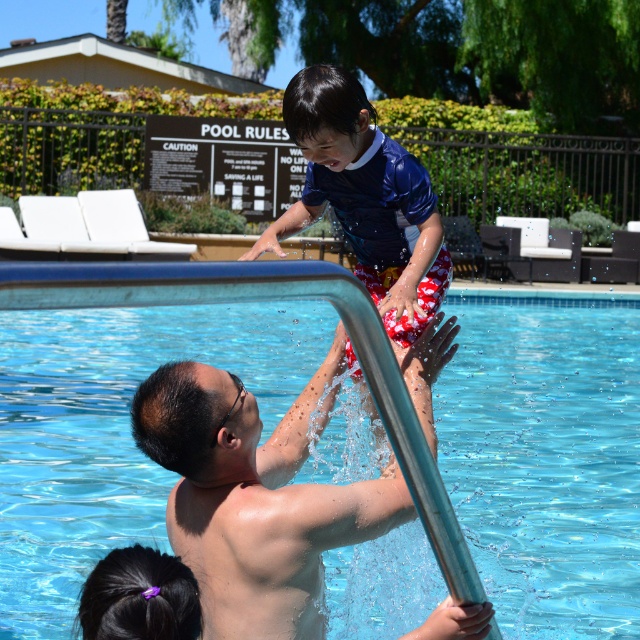
Question: Considering the real-world distances, which object is farthest from the purple hairband at lower left?

Choices:
 (A) shiny silver pole at center
 (B) clear blue water at center

Answer: (B)

Question: Does clear blue water at center appear over purple hairband at lower left?

Choices:
 (A) no
 (B) yes

Answer: (B)

Question: Which object is positioned closest to the clear blue water at center?

Choices:
 (A) purple hairband at lower left
 (B) shiny silver pole at center

Answer: (B)

Question: Is shiny silver pole at center thinner than purple hairband at lower left?

Choices:
 (A) no
 (B) yes

Answer: (A)

Question: From the image, what is the correct spatial relationship of clear blue water at center in relation to shiny silver pole at center?

Choices:
 (A) below
 (B) above

Answer: (B)

Question: Which object appears closest to the camera in this image?

Choices:
 (A) purple hairband at lower left
 (B) shiny silver pole at center
 (C) clear blue water at center

Answer: (C)